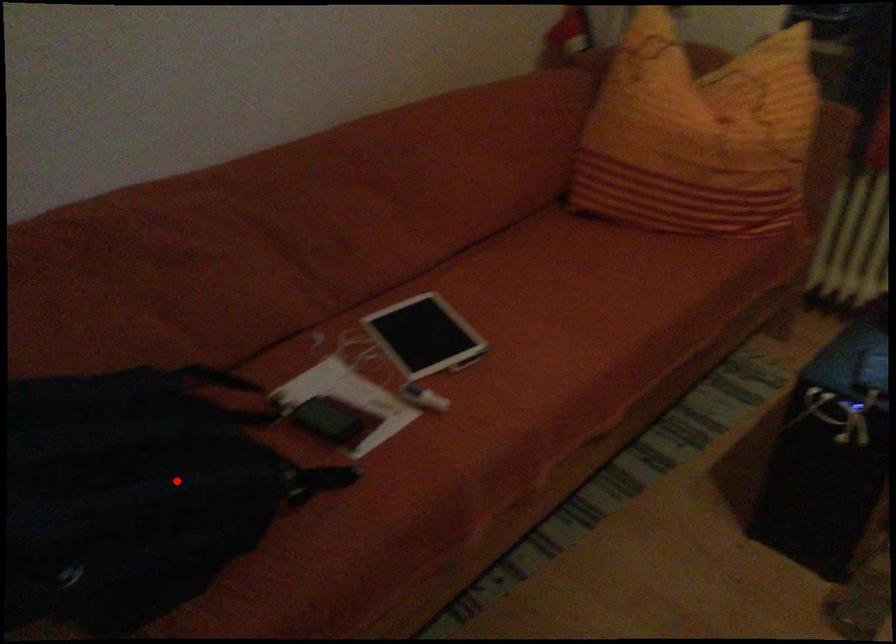
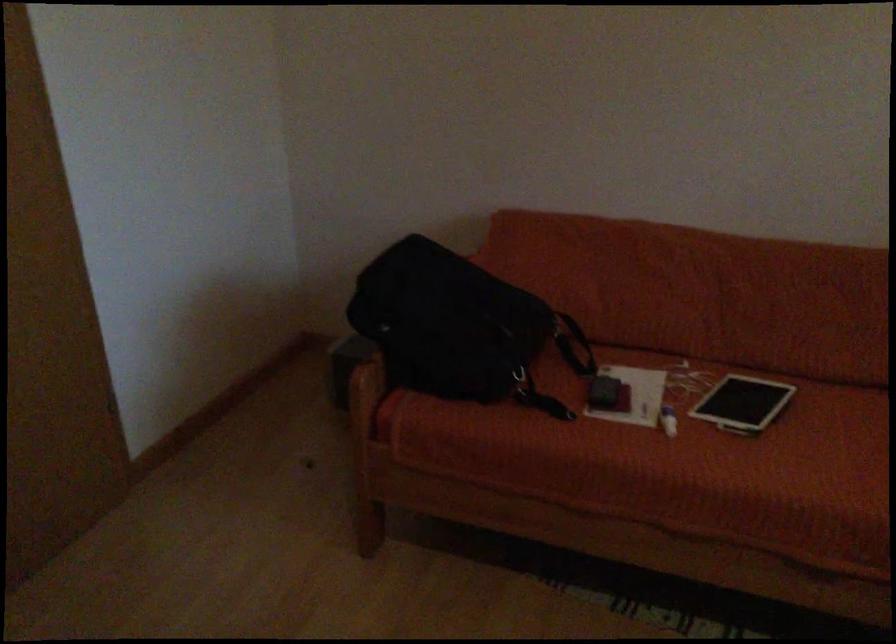
The point at the highlighted location is marked in the first image. Where is the corresponding point in the second image?

(460, 328)